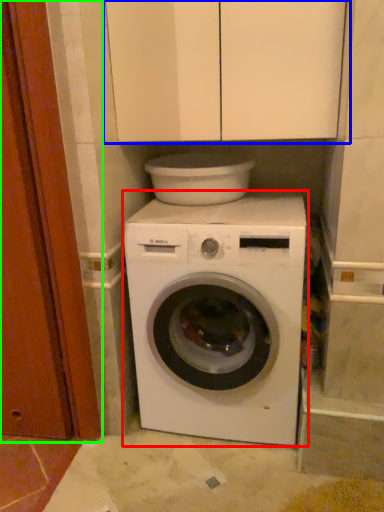
Question: Considering the real-world distances, which object is closest to washing machine (highlighted by a red box)? cabinetry (highlighted by a blue box) or door (highlighted by a green box).

Choices:
 (A) cabinetry
 (B) door

Answer: (B)